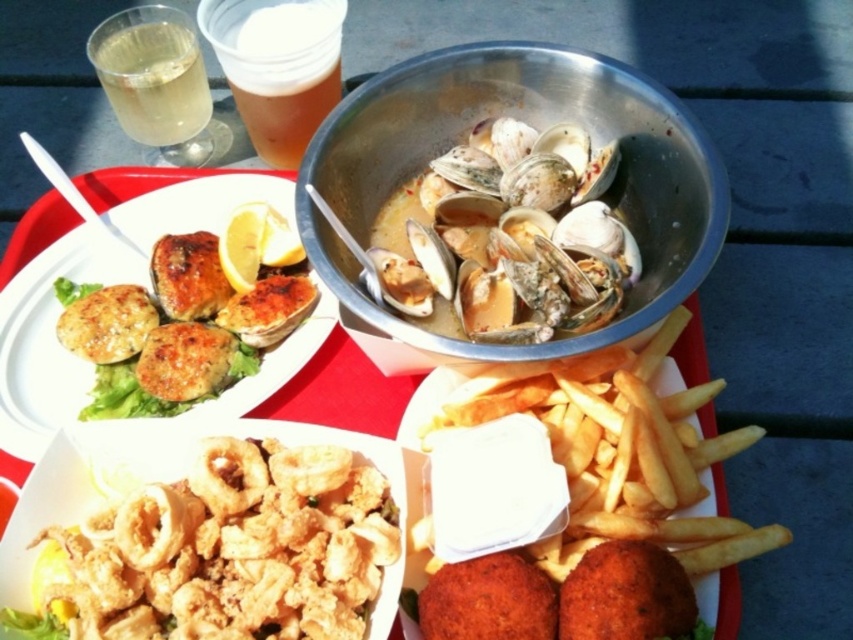
Question: Based on their relative distances, which object is nearer to the clear glass beverage at upper left?

Choices:
 (A) translucent plastic cup at upper left
 (B) shiny white shells at center
 (C) golden brown crusty fish cakes at upper left
 (D) golden crispy calamari at center

Answer: (A)

Question: Which object is closer to the camera taking this photo?

Choices:
 (A) golden brown crusty fish cakes at upper left
 (B) golden crispy calamari at center
 (C) clear glass beverage at upper left
 (D) shiny white shells at center

Answer: (B)

Question: Is golden crispy calamari at center smaller than shiny white shells at center?

Choices:
 (A) no
 (B) yes

Answer: (B)

Question: Where is golden crispy calamari at center located in relation to shiny white shells at center in the image?

Choices:
 (A) right
 (B) left

Answer: (B)

Question: Which of the following is the closest to the observer?

Choices:
 (A) shiny white shells at center
 (B) golden crispy calamari at center
 (C) golden brown crusty fish cakes at upper left
 (D) clear glass beverage at upper left

Answer: (B)

Question: Considering the relative positions of golden crispy calamari at center and clear glass beverage at upper left in the image provided, where is golden crispy calamari at center located with respect to clear glass beverage at upper left?

Choices:
 (A) above
 (B) below

Answer: (B)